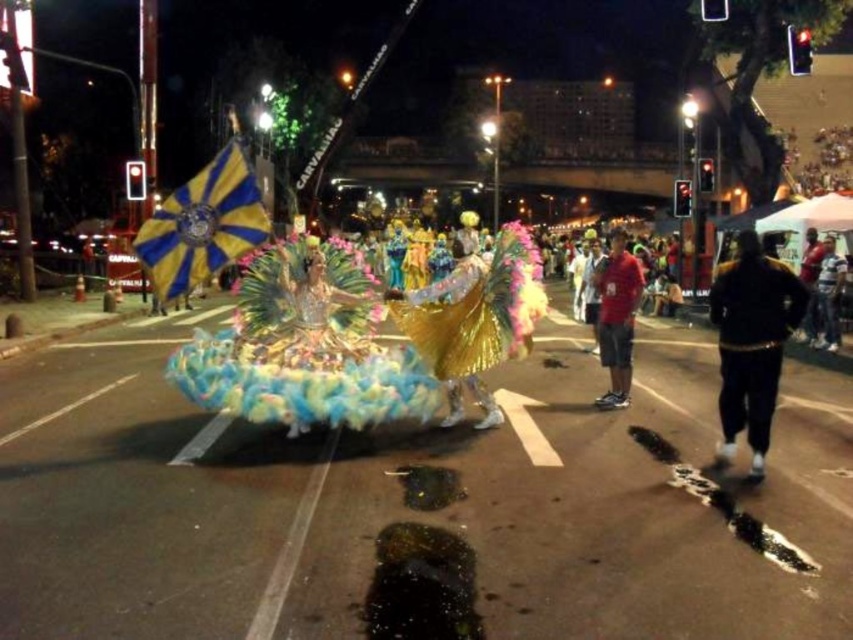
Looking at this image, can you confirm if white cotton shirt at right is positioned to the left of black leather jacket at right?

In fact, white cotton shirt at right is to the right of black leather jacket at right.

Is white cotton shirt at right closer to the viewer compared to black leather jacket at right?

Yes, it is.

Is point (822, 321) positioned before point (813, 342)?

Yes, point (822, 321) is closer to viewer.

Locate an element on the screen. The height and width of the screenshot is (640, 853). white cotton shirt at right is located at coordinates (827, 296).

Is point (753, 374) in front of point (811, 264)?

Yes, point (753, 374) is in front of point (811, 264).

Who is more forward, (x=743, y=266) or (x=805, y=236)?

Point (x=743, y=266)

Locate an element on the screen. black smooth tracksuit at lower right is located at coordinates (751, 340).

Is shiny gold costume at center to the right of black leather jacket at right from the viewer's perspective?

No, shiny gold costume at center is not to the right of black leather jacket at right.

I want to click on shiny gold costume at center, so click(474, 312).